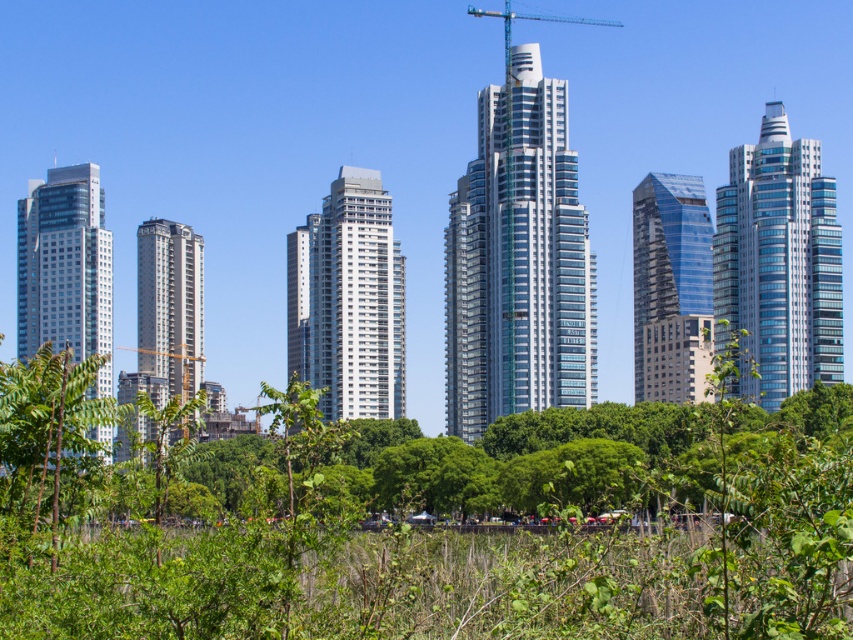
You are a construction worker observing the urban landscape. You notice the glassy blue skyscraper at right and the blue metallic crane at upper center. Which object is located higher in the image?

The blue metallic crane at upper center is positioned higher than the glassy blue skyscraper at right.

You are standing in the urban landscape and want to determine which of the two points, point (370, 276) or point (195, 376), is nearer to you. Based on the scene, which point is closer?

Point (370, 276) is closer to the viewer than point (195, 376).

You are standing at point A, which is located at coordinates (347,301). What can you see directly in front of you?

You can see the white glass building at center directly in front of you at point A.